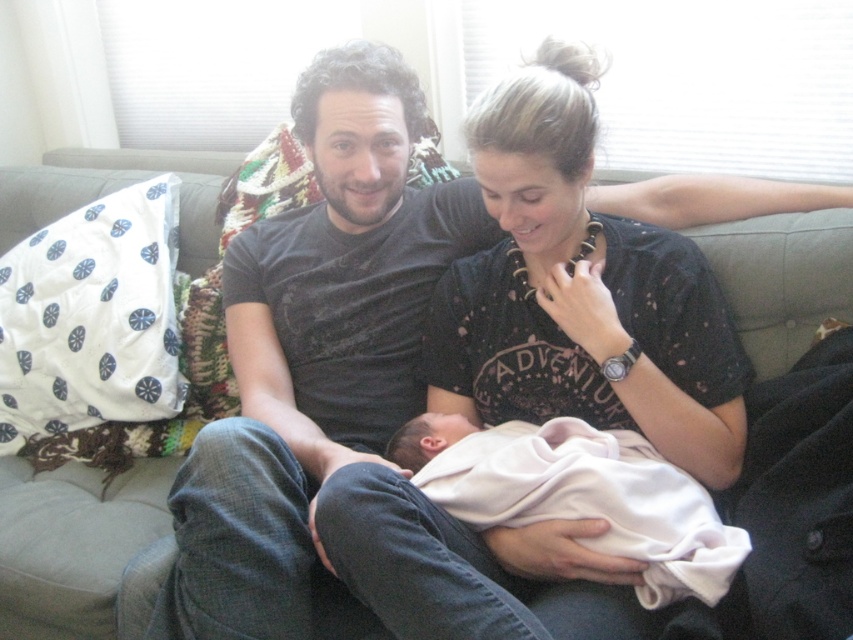
Who is lower down, black dotted shirt at center or pink soft fabric newborn at center?

pink soft fabric newborn at center

This screenshot has height=640, width=853. Describe the element at coordinates (579, 291) in the screenshot. I see `black dotted shirt at center` at that location.

Image resolution: width=853 pixels, height=640 pixels. What do you see at coordinates (579, 291) in the screenshot?
I see `black dotted shirt at center` at bounding box center [579, 291].

This screenshot has width=853, height=640. What are the coordinates of `black dotted shirt at center` in the screenshot? It's located at (579, 291).